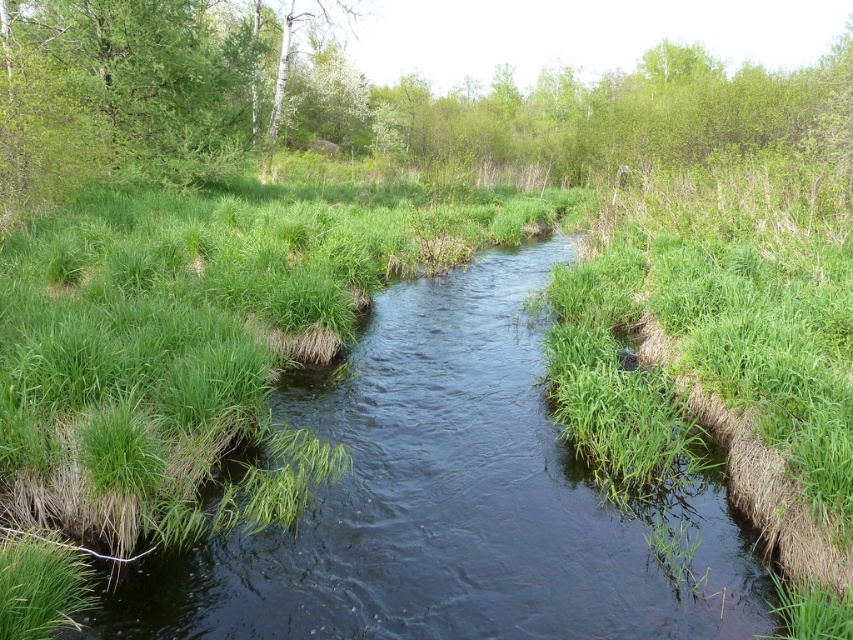
You are standing at the origin point in the image. Where is the green grassy stream at center located?

The green grassy stream at center is located at point 0.784 on the x axis and 0.528 on the y axis.

You are a hiker trying to cross the green grassy stream at center. There is a fallen log nearby that you can use as a bridge. The log is as long as the green leafy trees at upper center. Do you think the log will be long enough to cross the stream?

The green grassy stream at center is smaller than the green leafy trees at upper center. Since the log is as long as the green leafy trees at upper center, the log will be longer than the stream, so it should be long enough to cross the green grassy stream at center.